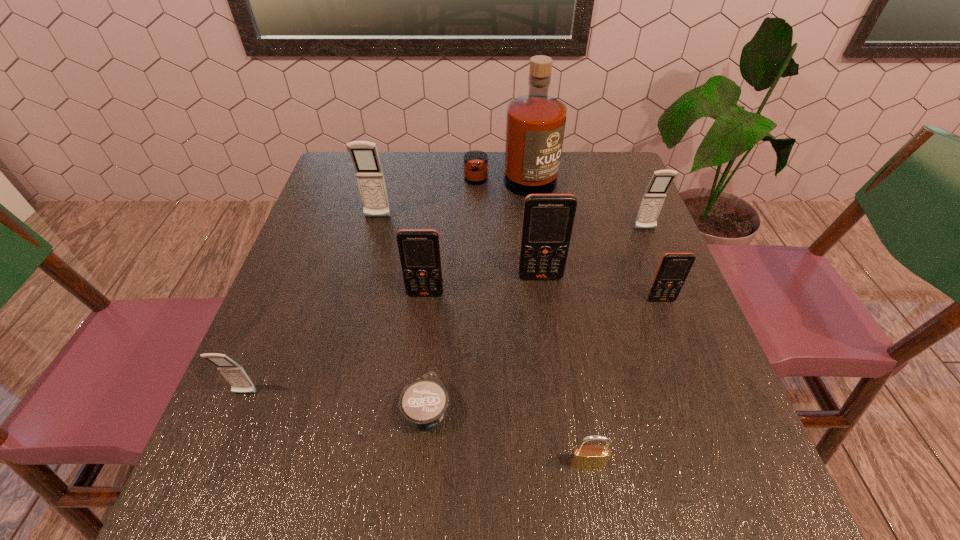
Where is `free space located on the screen of the second smallest orange cellular telephone`? This screenshot has width=960, height=540. free space located on the screen of the second smallest orange cellular telephone is located at coordinates (423, 316).

Where is `vacant space located 0.250m on the screen of the smallest orange cellular telephone`? vacant space located 0.250m on the screen of the smallest orange cellular telephone is located at coordinates (703, 411).

You are a GUI agent. You are given a task and a screenshot of the screen. Output one action in this format:
    pyautogui.click(x=<x>, y=<y>)
    Task: Click on the free region located 0.080m on the front-facing side of the leftmost object
    
    Given the screenshot: What is the action you would take?
    pyautogui.click(x=225, y=442)

Identify the location of vacant space located on the front-facing side of the padlock. The height and width of the screenshot is (540, 960). (596, 517).

Where is `vacant space located 0.110m on the left of the yogurt`? The width and height of the screenshot is (960, 540). vacant space located 0.110m on the left of the yogurt is located at coordinates pyautogui.click(x=340, y=410).

At what (x,y) coordinates should I click in order to perform the action: click on object that is positioned at the far edge. Please return your answer as a coordinate pair (x, y). The width and height of the screenshot is (960, 540). Looking at the image, I should click on (535, 123).

Where is `object at the near edge`? object at the near edge is located at coordinates (589, 456).

In the image, there is a desktop. Identify the location of vacant space at the far edge. The width and height of the screenshot is (960, 540). (387, 178).

Locate an element on the screen. Image resolution: width=960 pixels, height=540 pixels. free space at the near edge of the desktop is located at coordinates (412, 497).

Where is `free space at the left edge of the desktop`? Image resolution: width=960 pixels, height=540 pixels. free space at the left edge of the desktop is located at coordinates (329, 234).